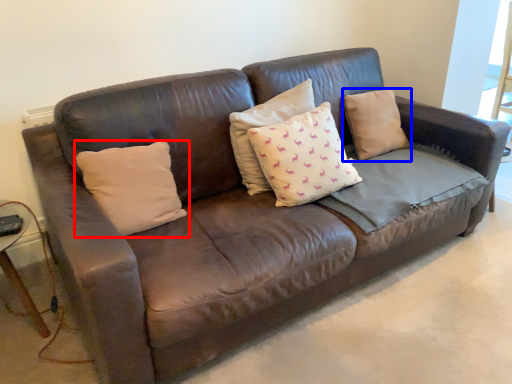
Question: Which point is closer to the camera, pillow (highlighted by a red box) or pillow (highlighted by a blue box)?

Choices:
 (A) pillow
 (B) pillow

Answer: (A)